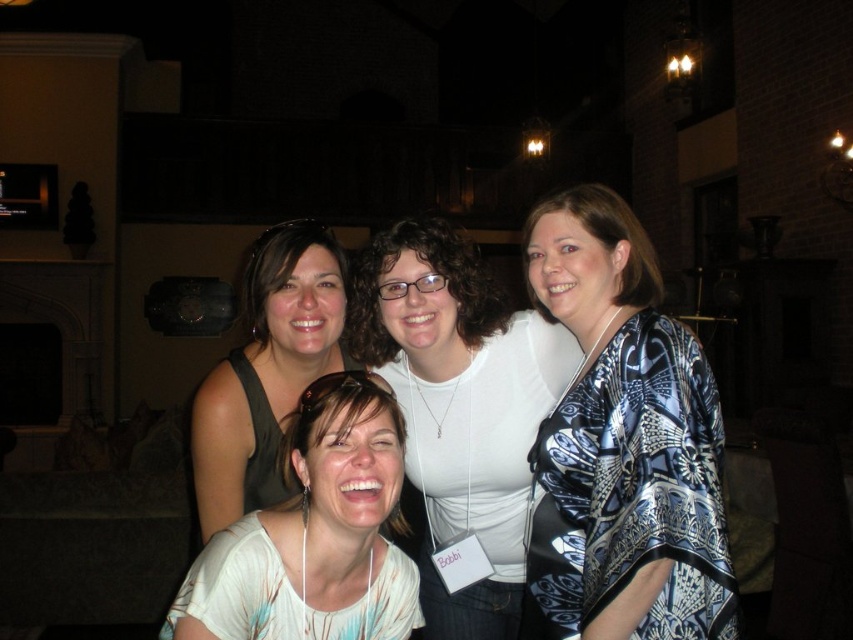
Question: Does white matte shirt at center have a larger size compared to matte black shirt at center?

Choices:
 (A) yes
 (B) no

Answer: (A)

Question: Is blue patterned shawl at center wider than matte black shirt at center?

Choices:
 (A) yes
 (B) no

Answer: (B)

Question: Which of the following is the farthest from the observer?

Choices:
 (A) matte black shirt at center
 (B) white fabric shirt at center
 (C) blue patterned shawl at center
 (D) white matte shirt at center

Answer: (D)

Question: Which of the following is the closest to the observer?

Choices:
 (A) (254, 346)
 (B) (523, 314)

Answer: (B)

Question: Does blue patterned shawl at center have a lesser width compared to white matte shirt at center?

Choices:
 (A) no
 (B) yes

Answer: (B)

Question: Which object is the closest to the white matte shirt at center?

Choices:
 (A) white fabric shirt at center
 (B) blue patterned shawl at center
 (C) matte black shirt at center

Answer: (B)